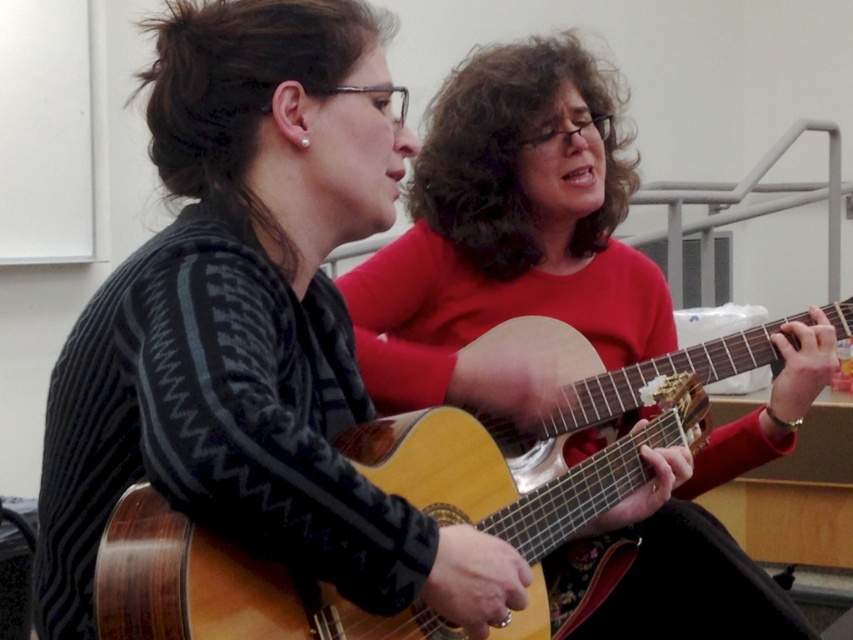
You are a music teacher in a classroom. You have two guitars available for students to try. The matte wood guitar at center and the wooden acoustic guitar at center. If a student prefers a larger instrument, which guitar should they choose?

The matte wood guitar at center is bigger than the wooden acoustic guitar at center, so the student should choose the matte wood guitar at center.